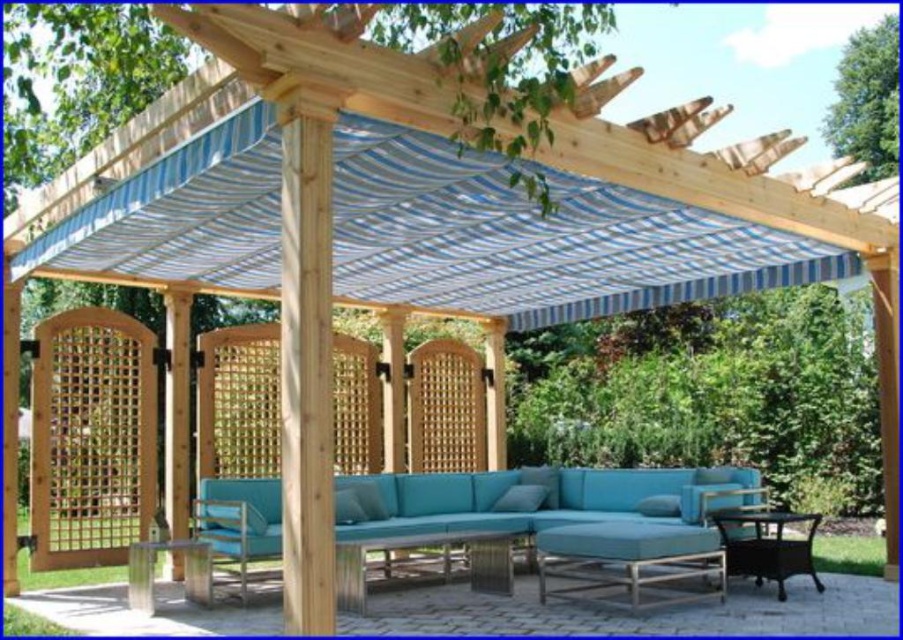
You are planning to place a new plant stand between the blue striped fabric canopy at upper center and the metallic silver chair at lower left. Based on the scene description, which object should the plant stand be closer to?

The plant stand should be closer to the metallic silver chair at lower left because the blue striped fabric canopy at upper center is positioned on the right side of the metallic silver chair at lower left, meaning the chair is to the left of the canopy.

You are standing at the point with coordinates point (779, 541) and want to move towards the wooden pergola. Is the point (604, 548) located in front of or behind you relative to your current position?

The point (604, 548) is in front of point (779, 541), so it is located in front of you relative to your current position at point (779, 541).